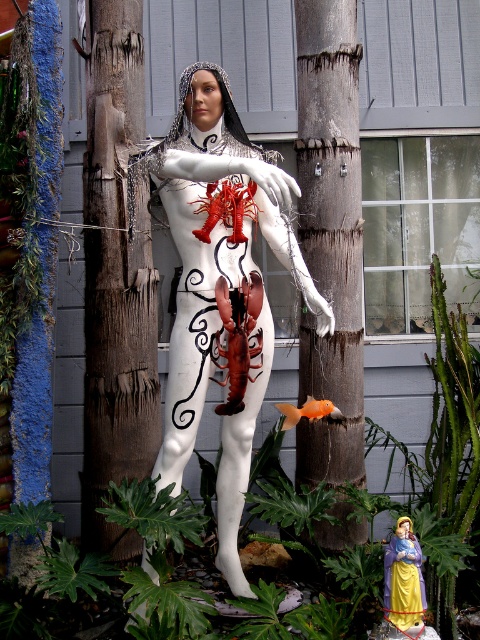
Question: Is white matte sculpture at center bigger than smooth brown wood at center?

Choices:
 (A) no
 (B) yes

Answer: (B)

Question: Among these objects, which one is farthest from the camera?

Choices:
 (A) white matte sculpture at center
 (B) smooth brown wood at center

Answer: (B)

Question: Does white matte sculpture at center have a greater width compared to smooth brown wood at center?

Choices:
 (A) yes
 (B) no

Answer: (A)

Question: Is white matte sculpture at center to the right of smooth brown wood at center from the viewer's perspective?

Choices:
 (A) yes
 (B) no

Answer: (B)